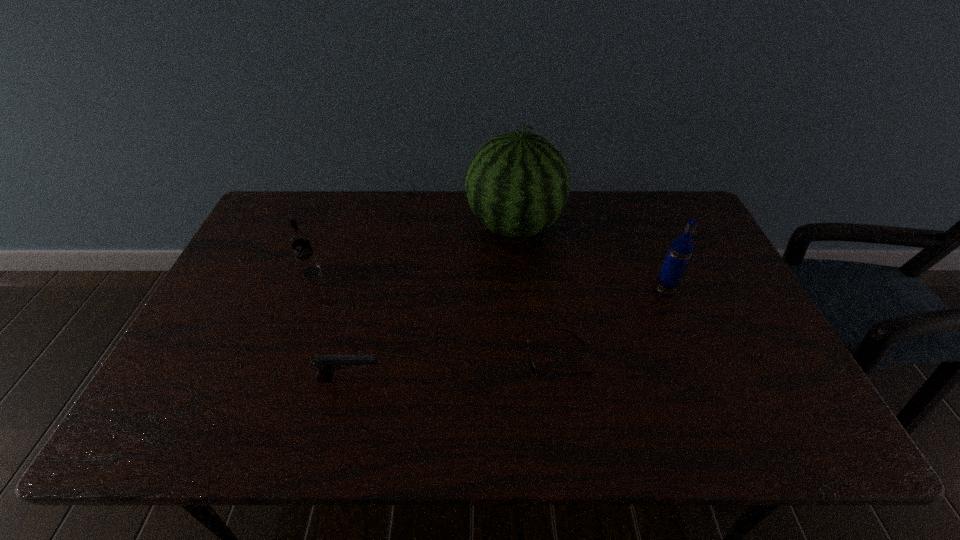
This screenshot has width=960, height=540. What are the coordinates of `free space between the second tallest object and the tallest object` in the screenshot? It's located at (589, 258).

Locate which object ranks fourth in proximity to the taller vodka. Please provide its 2D coordinates. Your answer should be formatted as a tuple, i.e. [(x, y)], where the tuple contains the x and y coordinates of a point satisfying the conditions above.

[(299, 240)]

Where is `object identified as the closest to the left vodka`? The height and width of the screenshot is (540, 960). object identified as the closest to the left vodka is located at coordinates (327, 364).

Where is `vacant region that satisfies the following two spatial constraints: 1. on the front side of the right vodka; 2. on the front-facing side of the sunglasses`? The height and width of the screenshot is (540, 960). vacant region that satisfies the following two spatial constraints: 1. on the front side of the right vodka; 2. on the front-facing side of the sunglasses is located at coordinates (692, 359).

Identify the location of free region that satisfies the following two spatial constraints: 1. on the label of the second farthest object; 2. on the left side of the third nearest object. (304, 289).